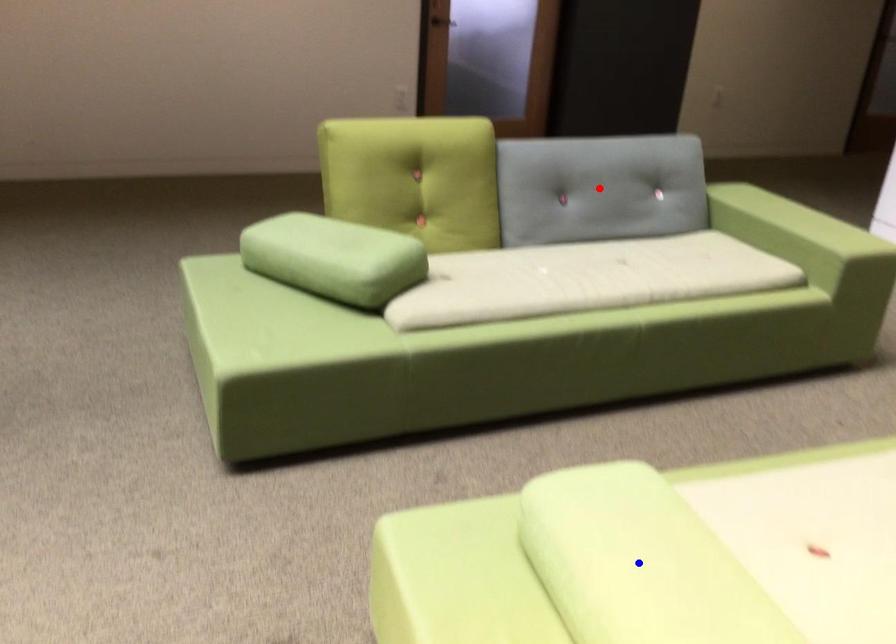
Question: Which of the two points in the image is closer to the camera?

Choices:
 (A) Blue point is closer.
 (B) Red point is closer.

Answer: (A)